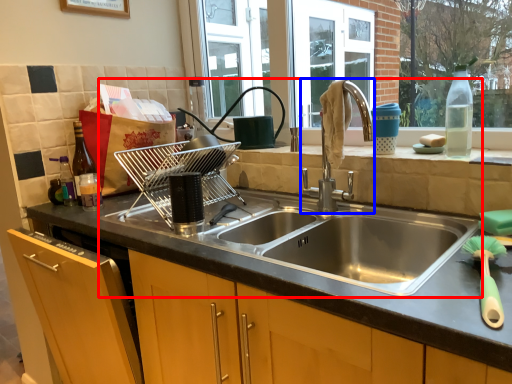
Question: Which object is further to the camera taking this photo, sink (highlighted by a red box) or tap (highlighted by a blue box)?

Choices:
 (A) sink
 (B) tap

Answer: (B)